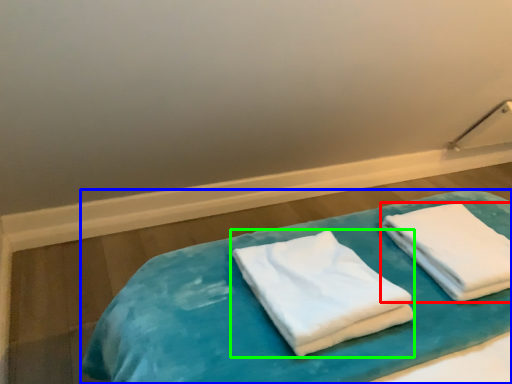
Question: Considering the real-world distances, which object is closest to towel (highlighted by a red box)? bed (highlighted by a blue box) or towel (highlighted by a green box).

Choices:
 (A) bed
 (B) towel

Answer: (A)